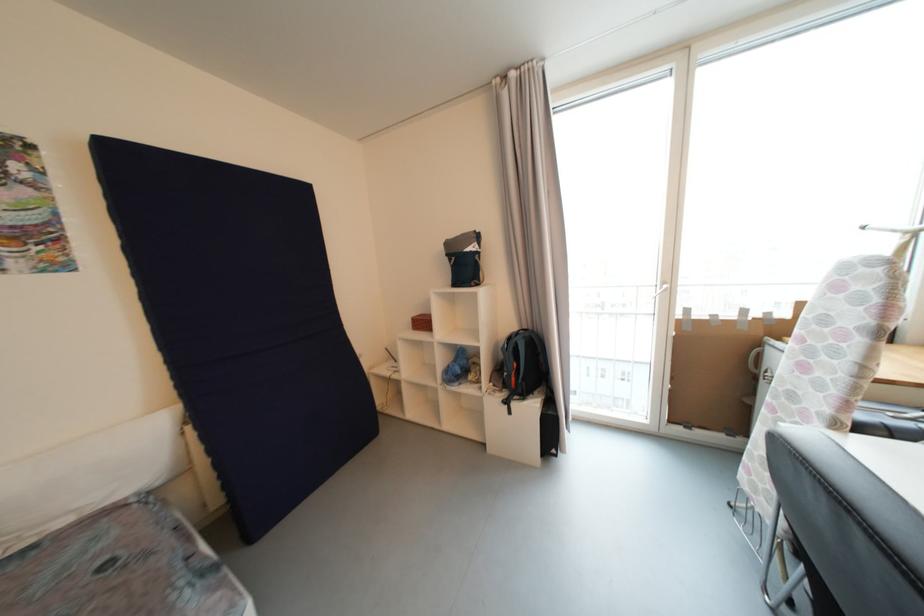
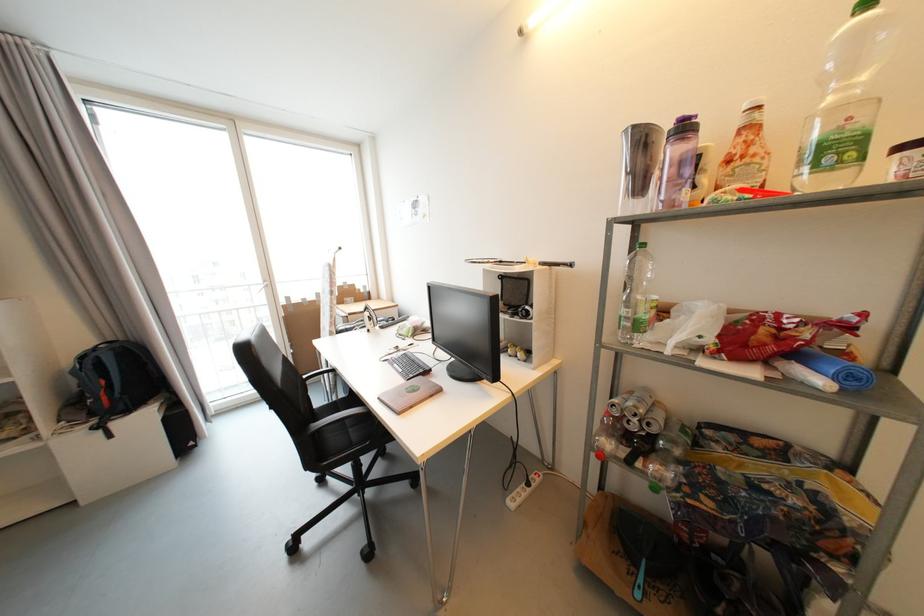
Question: The images are taken continuously from a first-person perspective. In which direction is your viewpoint rotating?

Choices:
 (A) Left
 (B) Right
 (C) Up
 (D) Down

Answer: (B)